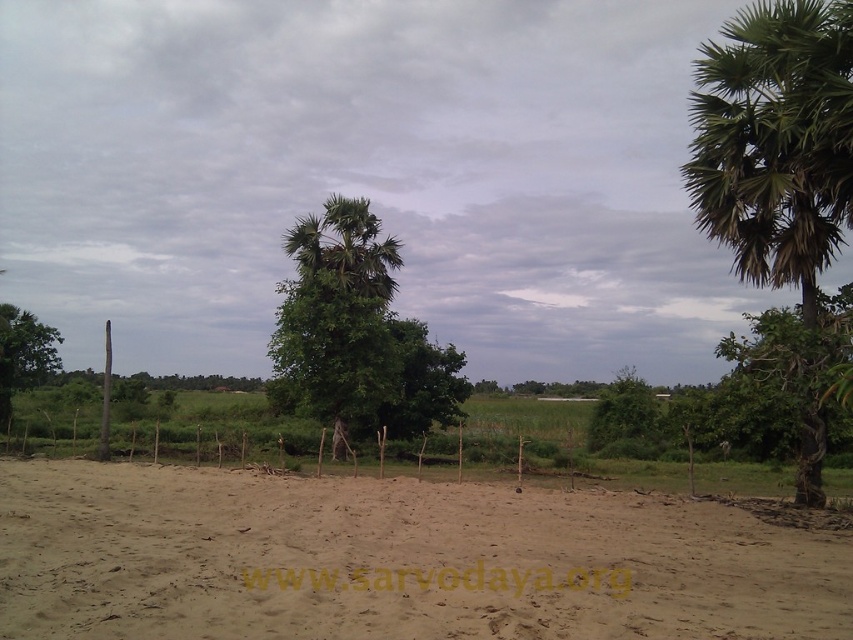
You are a hiker who wants to set up a tent on the brown sandy dirt field at center. You notice the green leafy palm tree at right nearby. Which object is taller, allowing you to tie a rope between them for hanging gear?

The green leafy palm tree at right is taller than the brown sandy dirt field at center, so you can tie a rope between them for hanging gear.